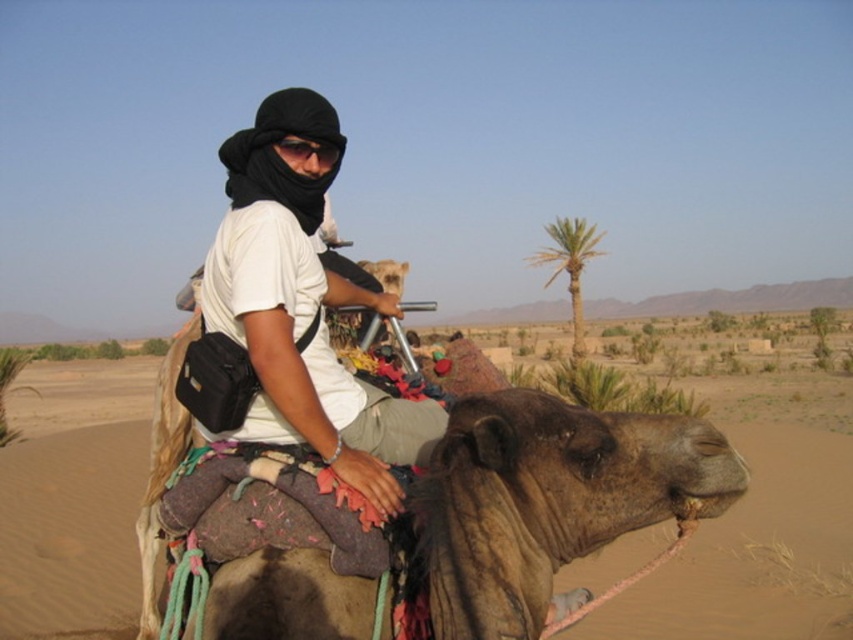
Question: Considering the real-world distances, which object is farthest from the green leafy palm tree at upper right?

Choices:
 (A) brown textured camel at center
 (B) black matte goggles at center
 (C) white matte shirt at center

Answer: (B)

Question: Among these objects, which one is nearest to the camera?

Choices:
 (A) green leafy palm tree at upper right
 (B) brown textured camel at center
 (C) black matte goggles at center

Answer: (C)

Question: Does white matte shirt at center have a lesser width compared to black matte goggles at center?

Choices:
 (A) no
 (B) yes

Answer: (A)

Question: In this image, where is brown textured camel at center located relative to white matte shirt at center?

Choices:
 (A) left
 (B) right

Answer: (B)

Question: Can you confirm if white matte shirt at center is positioned to the left of green leafy palm tree at upper right?

Choices:
 (A) yes
 (B) no

Answer: (A)

Question: Which is farther from the brown textured camel at center?

Choices:
 (A) green leafy palm tree at upper right
 (B) black matte goggles at center
 (C) white matte shirt at center

Answer: (A)